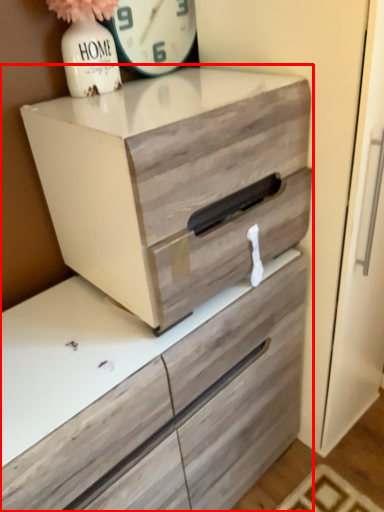
Question: From the image's perspective, what is the correct spatial positioning of chest of drawers (annotated by the red box) in reference to clock?

Choices:
 (A) below
 (B) above

Answer: (A)